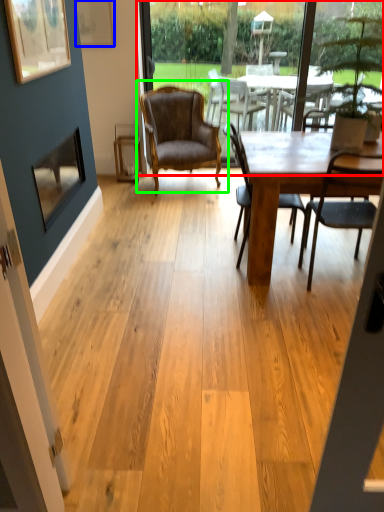
Question: Considering the real-world distances, which object is farthest from window screen (highlighted by a red box)? picture frame (highlighted by a blue box) or chair (highlighted by a green box)?

Choices:
 (A) picture frame
 (B) chair

Answer: (A)